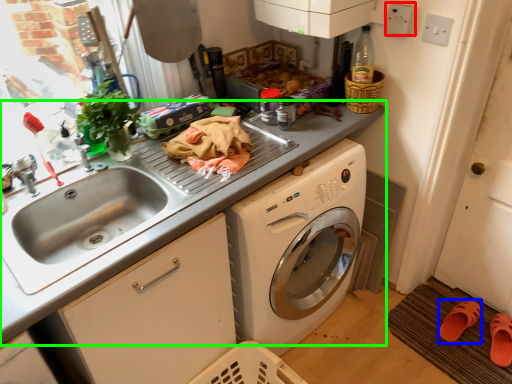
Question: Considering the real-world distances, which object is farthest from electric outlet (highlighted by a red box)? shoe (highlighted by a blue box) or countertop (highlighted by a green box)?

Choices:
 (A) shoe
 (B) countertop

Answer: (A)